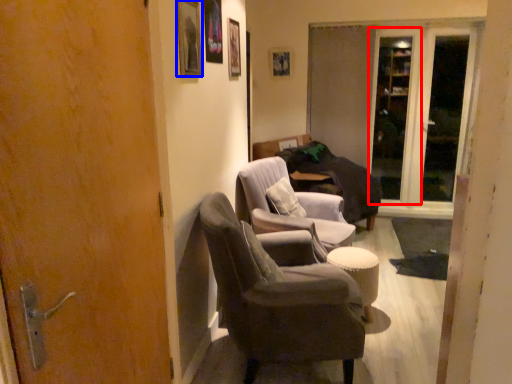
Question: Which object appears farthest to the camera in this image, screen door (highlighted by a red box) or picture frame (highlighted by a blue box)?

Choices:
 (A) screen door
 (B) picture frame

Answer: (A)